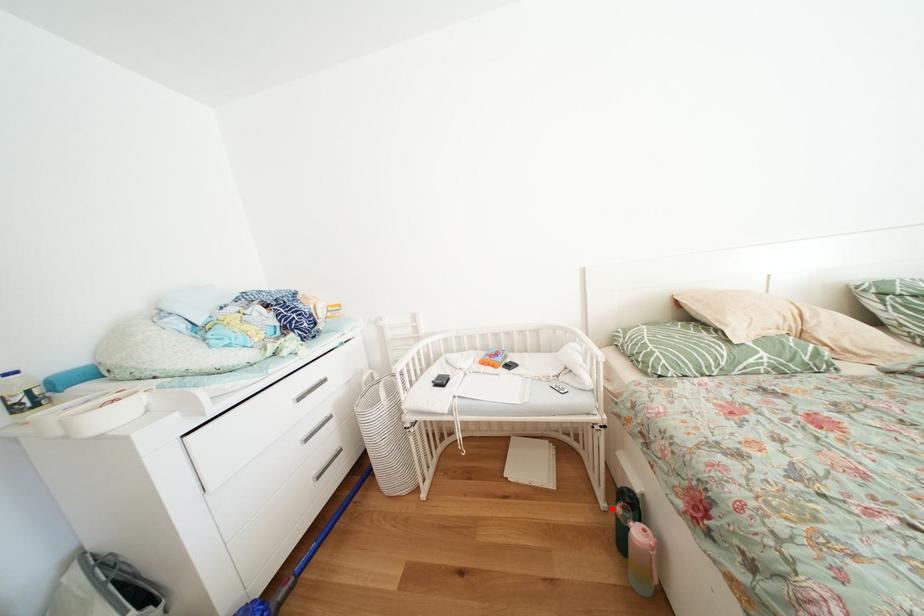
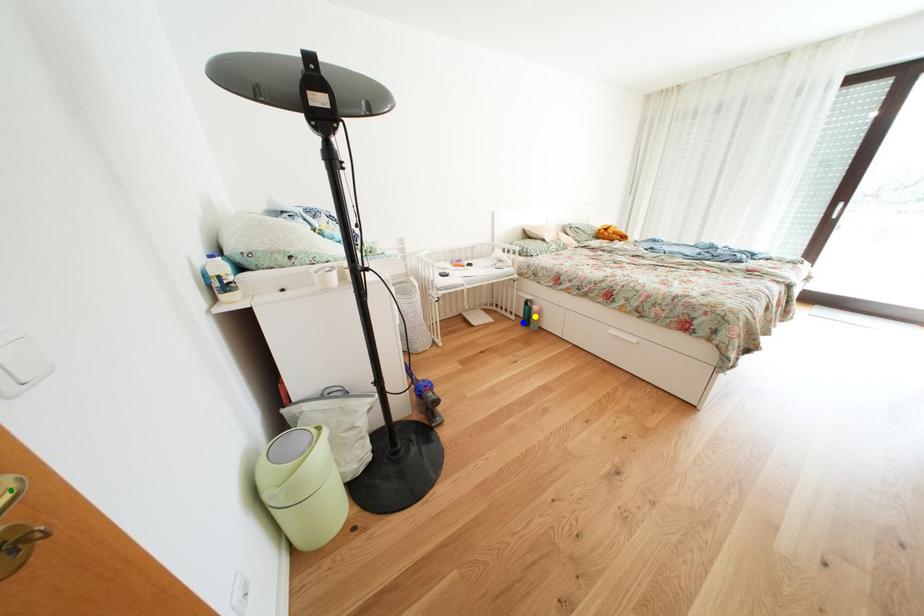
Question: I am providing you with two images of the same scene from different viewpoints. A red point is marked on the first image. You are given multiple points on the second image. Which spot in image 2 lines up with the point in image 1?

Choices:
 (A) yellow point
 (B) green point
 (C) blue point

Answer: (C)